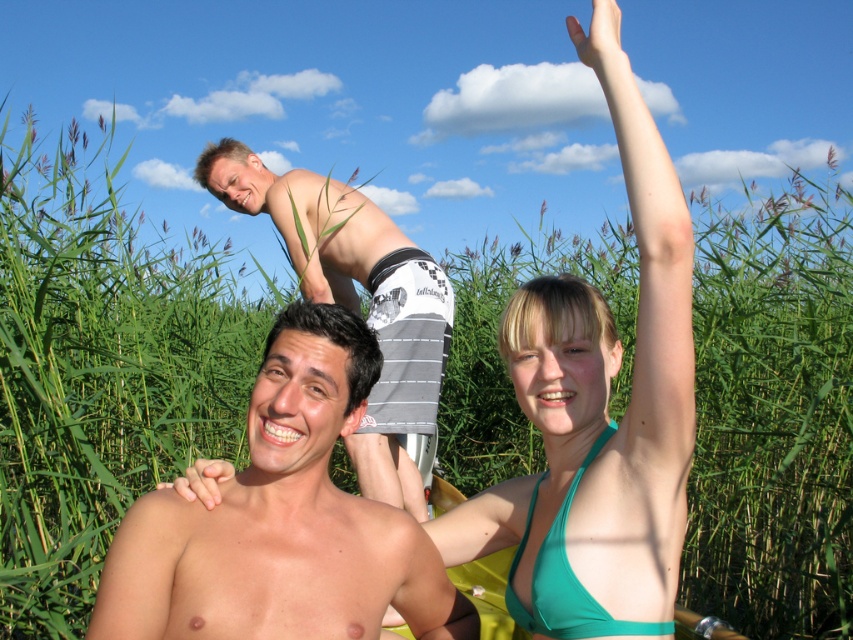
Question: Considering the relative positions of teal bikini top at upper right and smooth skin man at center in the image provided, where is teal bikini top at upper right located with respect to smooth skin man at center?

Choices:
 (A) above
 (B) below

Answer: (A)

Question: Among these objects, which one is farthest from the camera?

Choices:
 (A) gray striped shorts at upper center
 (B) smooth skin man at center
 (C) teal bikini top at upper right

Answer: (A)

Question: Among these objects, which one is nearest to the camera?

Choices:
 (A) teal bikini top at upper right
 (B) smooth skin man at center
 (C) gray striped shorts at upper center

Answer: (B)

Question: Considering the real-world distances, which object is farthest from the gray striped shorts at upper center?

Choices:
 (A) smooth skin man at center
 (B) teal bikini top at upper right

Answer: (A)

Question: Is teal bikini top at upper right smaller than smooth skin man at center?

Choices:
 (A) no
 (B) yes

Answer: (A)

Question: Does teal bikini top at upper right come in front of gray striped shorts at upper center?

Choices:
 (A) no
 (B) yes

Answer: (B)